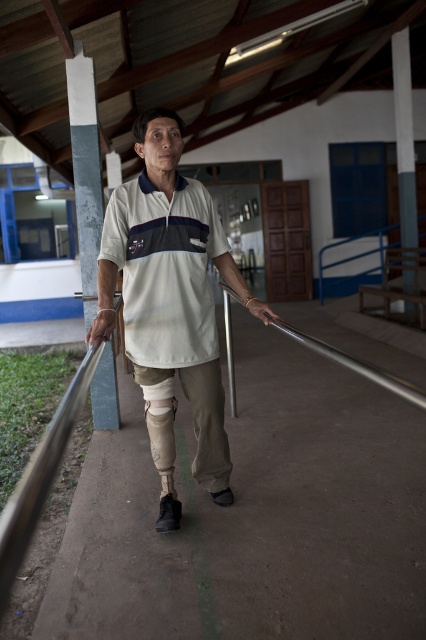
You are an architect designing a new walkway and want to ensure accessibility for all users. The smooth gray pole at upper right and the silver metallic rail at center are part of the existing structure. Which object should you consider modifying if you need to adjust the width to accommodate a wheelchair ramp?

The smooth gray pole at upper right might be wider than the silver metallic rail at center, so it should be considered for modification as it could be the wider obstruction.